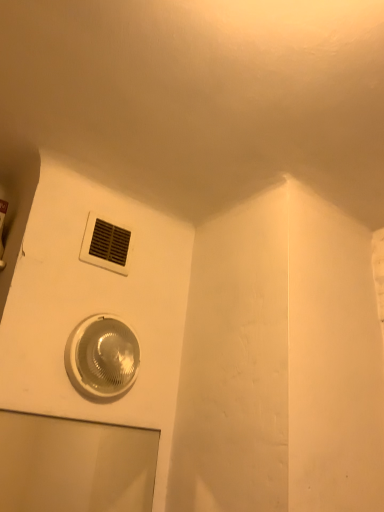
Question: Can you confirm if transparent glass door at lower left is positioned to the right of white plastic air conditioning at upper center?

Choices:
 (A) yes
 (B) no

Answer: (B)

Question: From a real-world perspective, is transparent glass door at lower left located higher than white plastic air conditioning at upper center?

Choices:
 (A) yes
 (B) no

Answer: (B)

Question: Considering the relative positions of transparent glass door at lower left and white plastic air conditioning at upper center in the image provided, is transparent glass door at lower left to the left of white plastic air conditioning at upper center from the viewer's perspective?

Choices:
 (A) yes
 (B) no

Answer: (A)

Question: Can you confirm if transparent glass door at lower left is shorter than white plastic air conditioning at upper center?

Choices:
 (A) yes
 (B) no

Answer: (B)

Question: Is the position of transparent glass door at lower left less distant than that of white plastic air conditioning at upper center?

Choices:
 (A) no
 (B) yes

Answer: (B)

Question: From a real-world perspective, is translucent plastic light fixture at lower center above or below transparent glass door at lower left?

Choices:
 (A) above
 (B) below

Answer: (A)

Question: Is translucent plastic light fixture at lower center to the left or to the right of transparent glass door at lower left in the image?

Choices:
 (A) right
 (B) left

Answer: (A)

Question: Is point (79, 373) positioned closer to the camera than point (39, 472)?

Choices:
 (A) farther
 (B) closer

Answer: (B)

Question: From the image's perspective, is translucent plastic light fixture at lower center located above or below transparent glass door at lower left?

Choices:
 (A) below
 (B) above

Answer: (B)

Question: Is transparent glass door at lower left in front of or behind white plastic air conditioning at upper center in the image?

Choices:
 (A) front
 (B) behind

Answer: (A)

Question: From the image's perspective, is transparent glass door at lower left above or below white plastic air conditioning at upper center?

Choices:
 (A) below
 (B) above

Answer: (A)

Question: Looking at their shapes, would you say transparent glass door at lower left is wider or thinner than white plastic air conditioning at upper center?

Choices:
 (A) wide
 (B) thin

Answer: (B)

Question: From a real-world perspective, is transparent glass door at lower left physically located above or below white plastic air conditioning at upper center?

Choices:
 (A) below
 (B) above

Answer: (A)

Question: Is white plastic air conditioning at upper center in front of or behind translucent plastic light fixture at lower center in the image?

Choices:
 (A) front
 (B) behind

Answer: (B)

Question: In the image, is white plastic air conditioning at upper center on the left side or the right side of translucent plastic light fixture at lower center?

Choices:
 (A) left
 (B) right

Answer: (A)